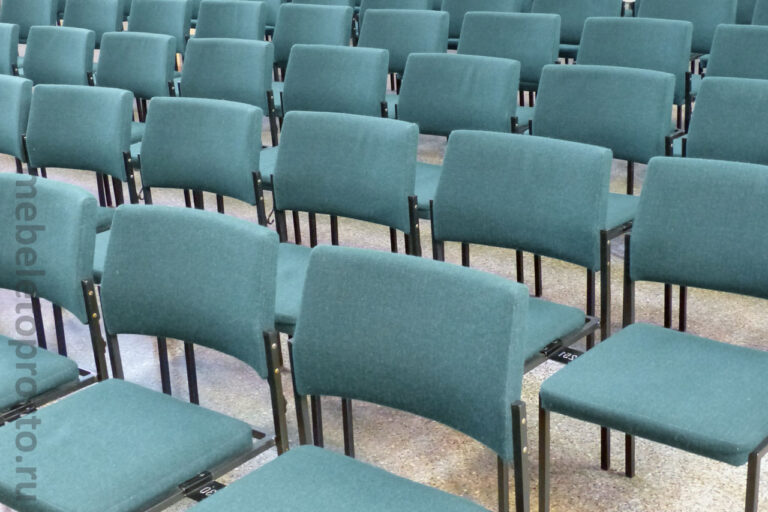
The width and height of the screenshot is (768, 512). Find the location of `chairs in second row from the front`. chairs in second row from the front is located at coordinates (12, 104), (45, 108), (209, 142), (508, 181), (359, 179), (694, 209).